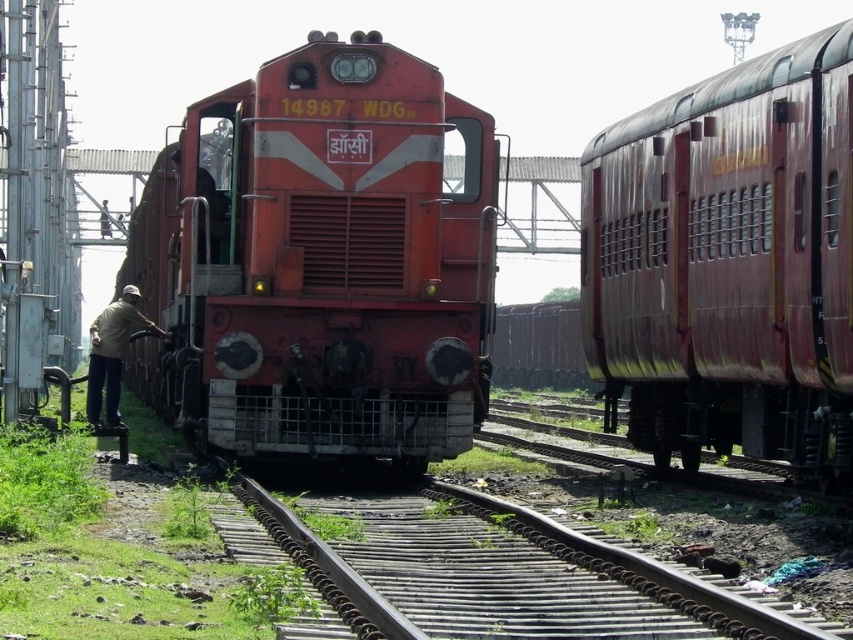
You are a railway worker inspecting the tracks. You notice the rusty metal train track at center and the light brown fabric cap at left. Which object is shorter in height?

The rusty metal train track at center is shorter than the light brown fabric cap at left.

You are standing on the platform looking at the matte red locomotive at center and the rusty metal train track at center. Which object is closer to you?

The matte red locomotive at center is closer to you than the rusty metal train track at center because it is further to the viewer.

From the picture: You are a railway inspector checking the alignment of the rusty metal train car at right and the rusty metal train track at center. Based on the scene, which object is located to the right of the other?

The rusty metal train car at right is positioned on the right side of the rusty metal train track at center.